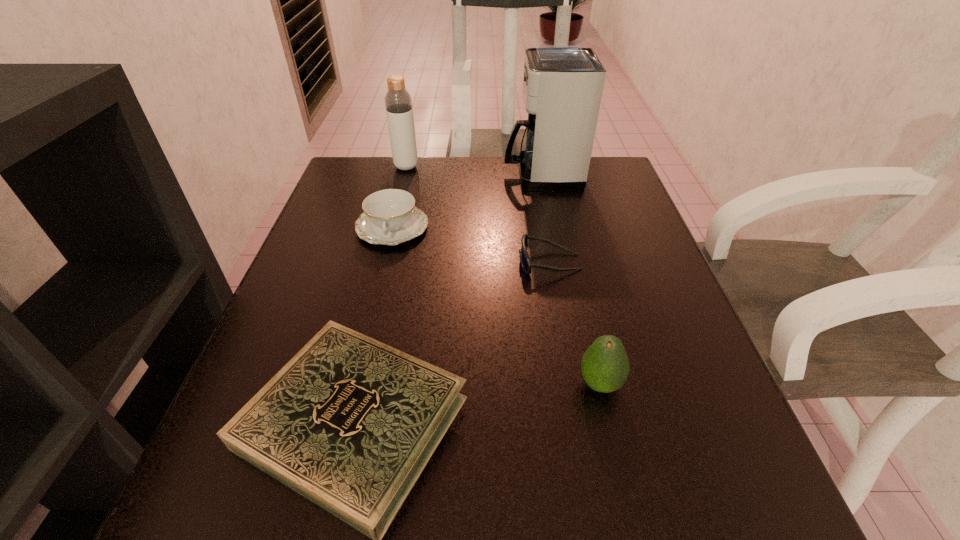
I want to click on free space between the bottle and the tallest object, so click(x=474, y=170).

The image size is (960, 540). In order to click on unoccupied position between the second tallest object and the tallest object in this screenshot , I will do `click(474, 170)`.

Image resolution: width=960 pixels, height=540 pixels. I want to click on unoccupied position between the bottle and the tallest object, so 474,170.

I want to click on free area in between the chinaware and the avocado, so click(496, 306).

Image resolution: width=960 pixels, height=540 pixels. I want to click on object that is the closest to the hardback book, so pyautogui.click(x=605, y=367).

The width and height of the screenshot is (960, 540). Find the location of `object that is the second nearest to the chinaware`. object that is the second nearest to the chinaware is located at coordinates (562, 84).

Identify the location of free space in the image that satisfies the following two spatial constraints: 1. on the front-facing side of the avocado; 2. on the left side of the sunglasses. The image size is (960, 540). (570, 384).

Identify the location of vacant position in the image that satisfies the following two spatial constraints: 1. on the back side of the third tallest object; 2. on the front panel of the coffee maker. (551, 174).

Locate an element on the screen. This screenshot has height=540, width=960. vacant space that satisfies the following two spatial constraints: 1. on the handle side of the fourth shortest object; 2. on the right side of the fourth tallest object is located at coordinates (354, 384).

Find the location of a particular element. The width and height of the screenshot is (960, 540). vacant region that satisfies the following two spatial constraints: 1. on the front panel of the coffee maker; 2. on the handle side of the chinaware is located at coordinates (553, 227).